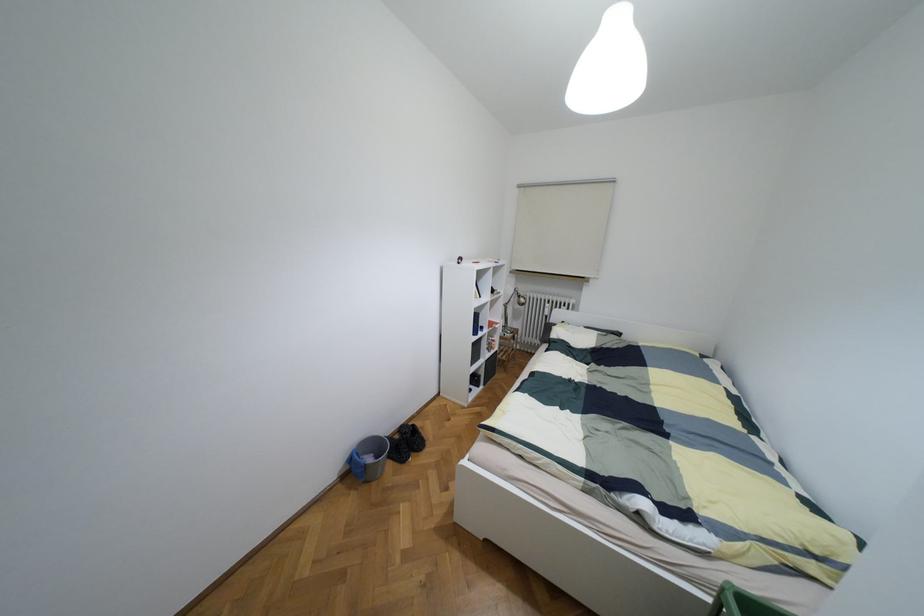
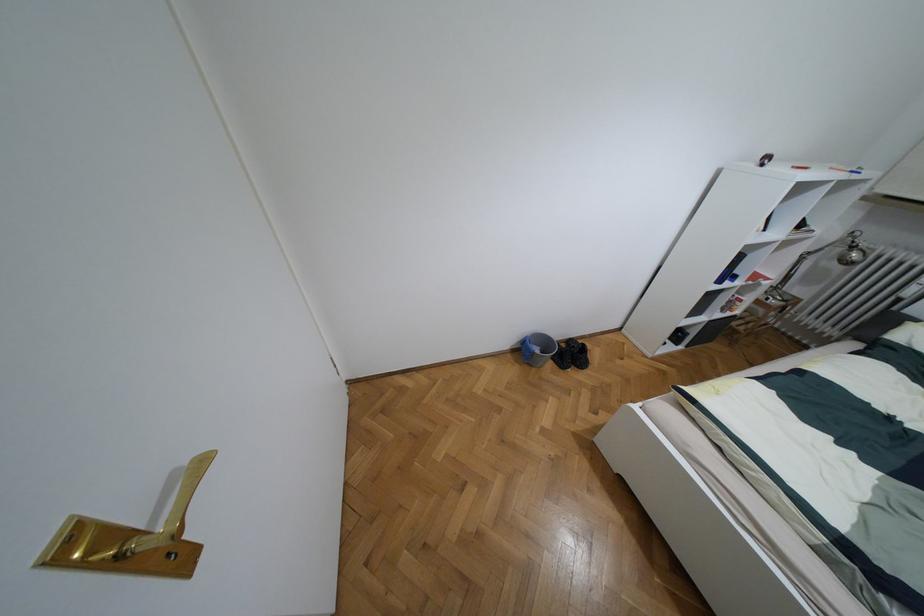
Find the pixel in the second image that matches the point at 369,459 in the first image.

(536, 350)